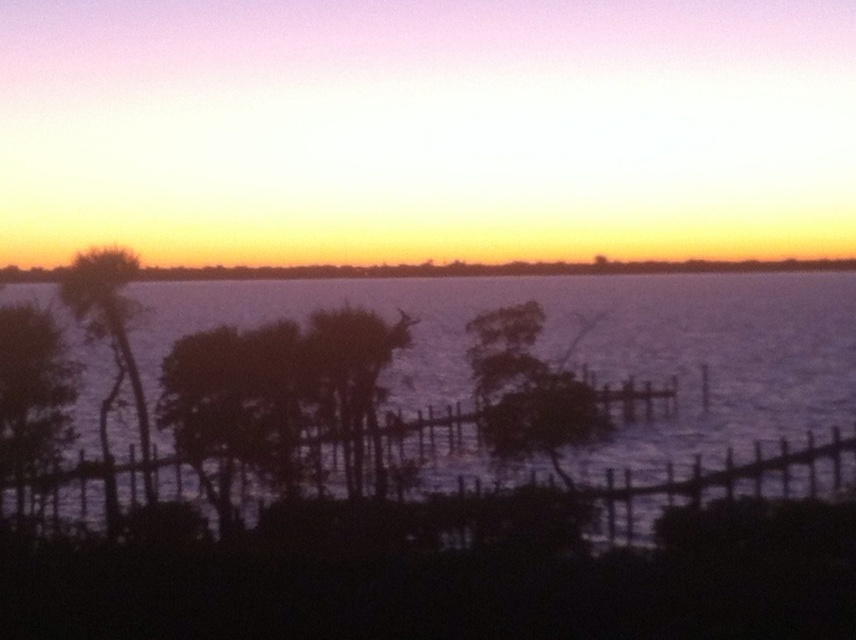
You are standing in the serene sunset scene and want to take a photo of the dark green leafy tree at left. Where should you position yourself to capture it in the frame?

To capture the dark green leafy tree at left in the frame, position yourself at point (33, 394) where the tree is located.

You are an artist trying to paint the sunset scene. You need to place the dark green leafy tree at left and the silhouette palm tree at left accurately. According to the scene, which tree is positioned lower in the image?

The dark green leafy tree at left is located below the silhouette palm tree at left, so the dark green leafy tree at left is positioned lower in the image.

You are an artist trying to paint the sunset scene. You notice the purple water at center and the silhouette wood tree at center. Which object is positioned to the right side of the other?

The purple water at center is to the right of the silhouette wood tree at center.